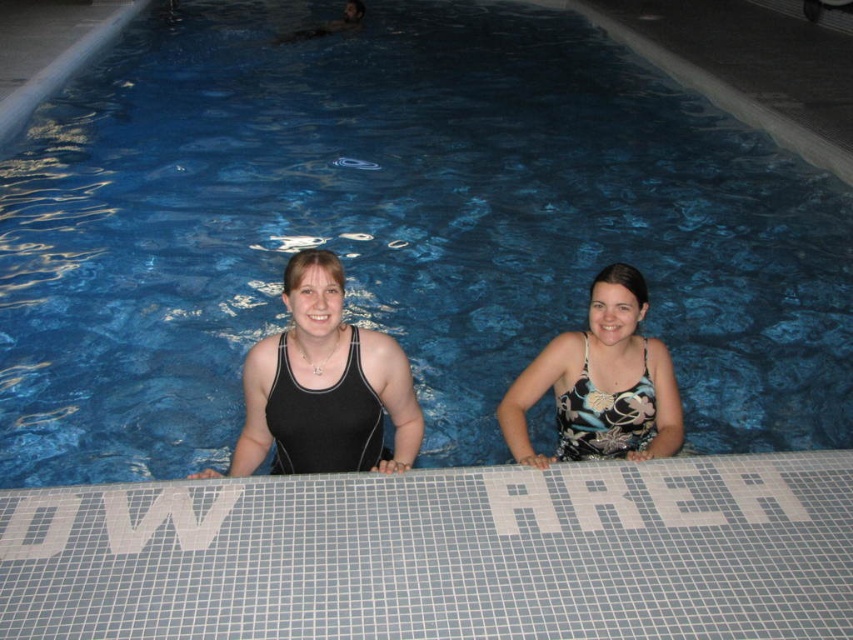
You are a photographer trying to capture a photo of both the black matte swimsuit at center and the floral print tank top at center. Which one should you focus on first if you want to include both in your shot without moving the camera?

You should focus on the black matte swimsuit at center first because it is positioned to the left of the floral print tank top at center, so capturing it first ensures both are in frame without needing to adjust the camera position.

In the scene shown: You are a photographer trying to capture the black matte swimsuit at center and the floral print tank top at center in the same frame. Which clothing item is covering the other one?

The black matte swimsuit at center is positioned over the floral print tank top at center, so it is covering it.